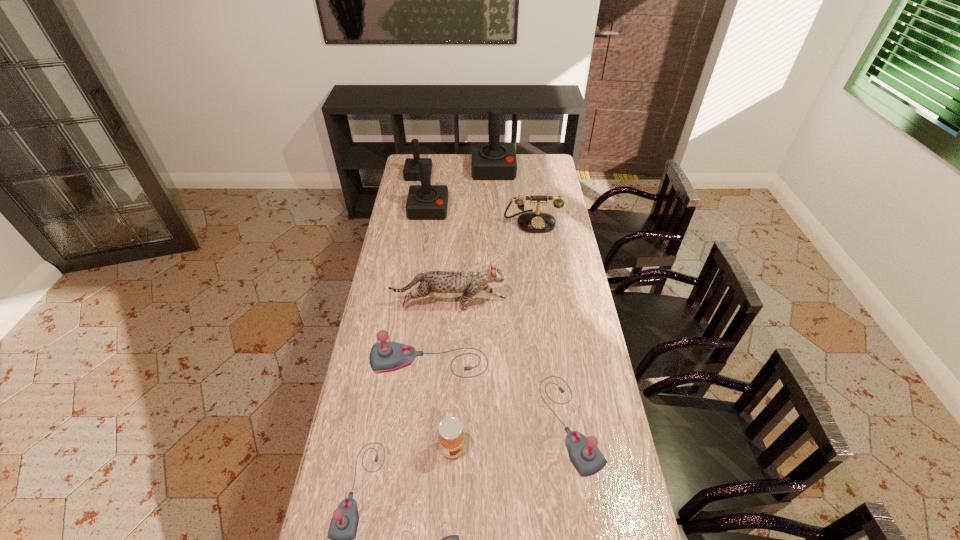
Where is `the rightmost red joystick`? This screenshot has height=540, width=960. the rightmost red joystick is located at coordinates (490, 161).

Locate an element on the screen. The image size is (960, 540). the biggest red joystick is located at coordinates (490, 161).

I want to click on the ninth shortest object, so click(x=424, y=202).

I want to click on the second biggest red joystick, so click(x=424, y=202).

The width and height of the screenshot is (960, 540). What are the coordinates of `the smallest red joystick` in the screenshot? It's located at (411, 167).

This screenshot has height=540, width=960. Identify the location of the fifth farthest object. (469, 284).

Find the location of a particular element. telephone is located at coordinates (533, 222).

The image size is (960, 540). Find the location of `the fourth shortest joystick`. the fourth shortest joystick is located at coordinates (391, 356).

Find the location of a particular element. honey is located at coordinates (451, 436).

Find the location of a particular element. the rightmost gray joystick is located at coordinates (587, 459).